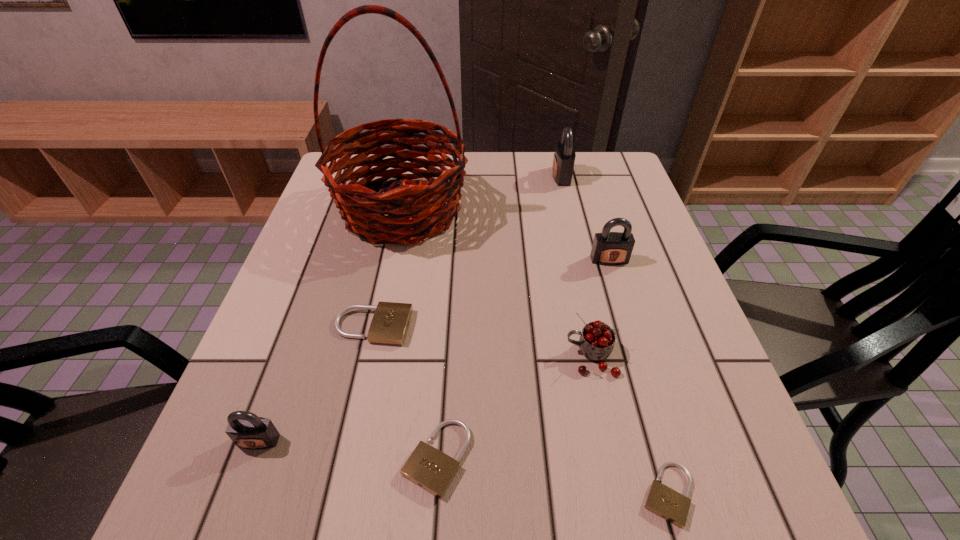
What are the coordinates of `free spot located 0.250m on the handle side of the red cherry` in the screenshot? It's located at (434, 357).

Where is `vacant space located on the handle side of the red cherry`? vacant space located on the handle side of the red cherry is located at coordinates (444, 357).

Where is `vacant space situated 0.050m on the front of the fourth shortest padlock near the keyhole`? This screenshot has height=540, width=960. vacant space situated 0.050m on the front of the fourth shortest padlock near the keyhole is located at coordinates (243, 483).

Identify the location of vacant position located on the right of the farthest beige padlock. The image size is (960, 540). (475, 326).

What are the coordinates of `vacant point located 0.240m on the right of the seventh tallest object` in the screenshot? It's located at (621, 458).

This screenshot has width=960, height=540. What are the coordinates of `vacant area located 0.210m on the back of the smallest beige padlock` in the screenshot? It's located at (627, 353).

Identify the location of basket positioned at the far edge. Image resolution: width=960 pixels, height=540 pixels. (423, 201).

Find the location of a particular element. The width and height of the screenshot is (960, 540). padlock present at the far edge is located at coordinates (564, 157).

You are a GUI agent. You are given a task and a screenshot of the screen. Output one action in this format:
    pyautogui.click(x=<x>, y=<y>)
    Task: Click on the basket situated at the left edge
    
    Given the screenshot: What is the action you would take?
    pyautogui.click(x=423, y=201)

Where is `object present at the far left corner`? The image size is (960, 540). object present at the far left corner is located at coordinates (423, 201).